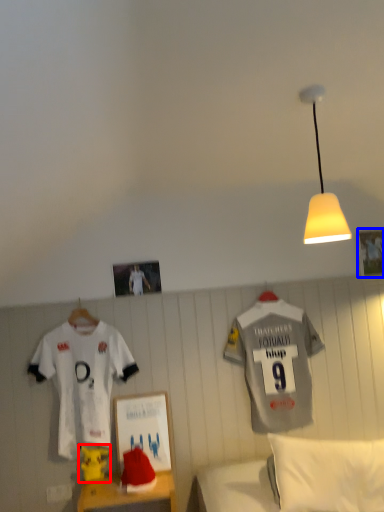
Question: Which point is closer to the camera, toy (highlighted by a red box) or picture frame (highlighted by a blue box)?

Choices:
 (A) toy
 (B) picture frame

Answer: (A)